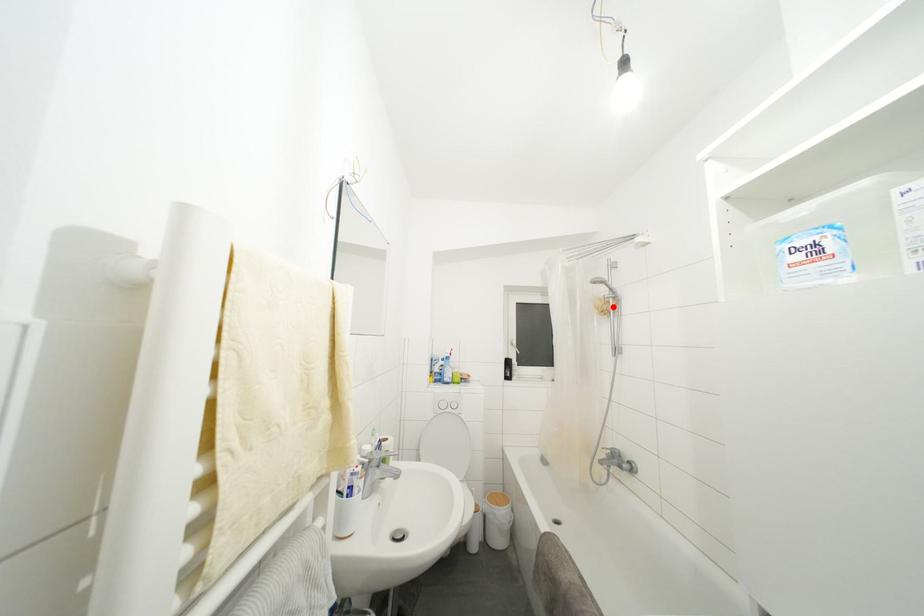
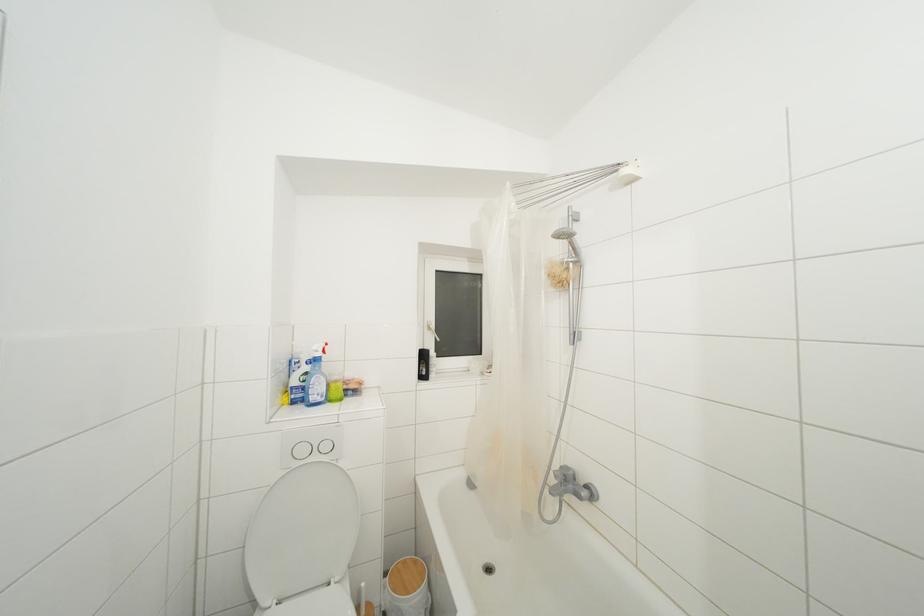
In the second image, find the point that corresponds to the highlighted location in the first image.

(572, 273)